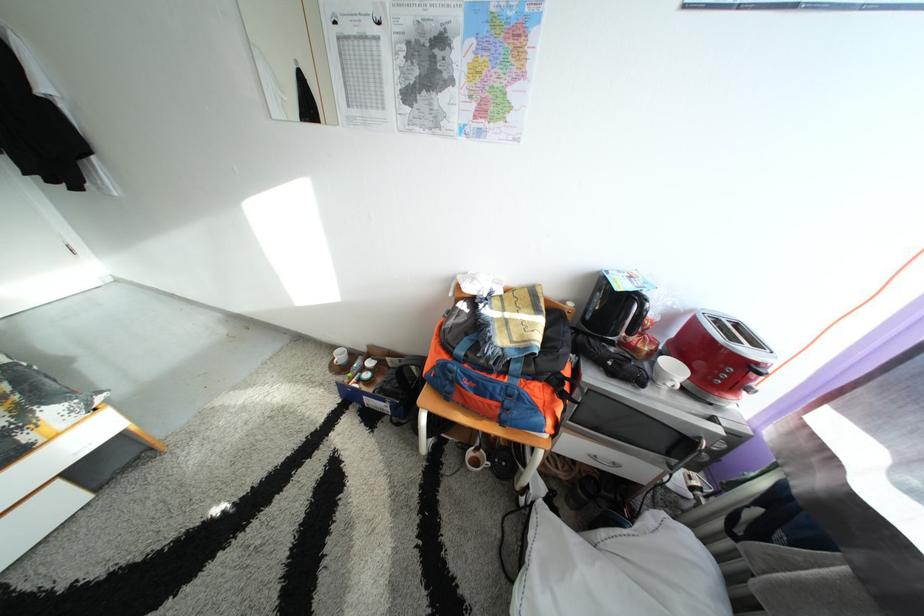
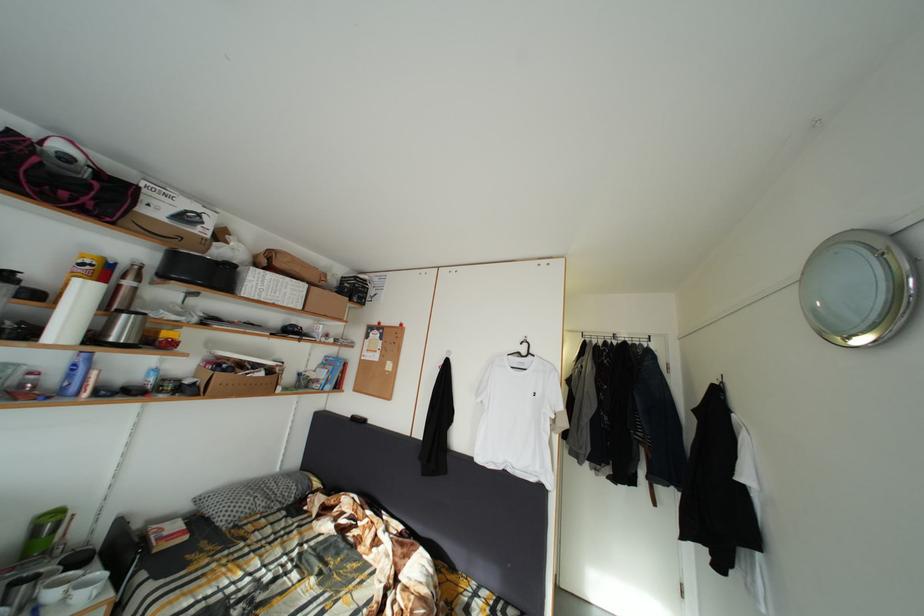
Question: The camera is either moving clockwise (left) or counter-clockwise (right) around the object. The first image is from the beginning of the video and the second image is from the end. Is the camera moving left or right when shooting the video?

Choices:
 (A) Left
 (B) Right

Answer: (B)